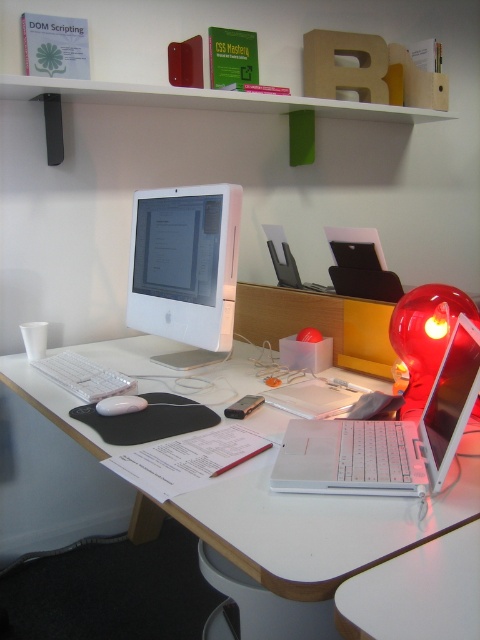
Can you confirm if white plastic laptop at right is shorter than white matte mouse at center?

In fact, white plastic laptop at right may be taller than white matte mouse at center.

Which is more to the right, white plastic laptop at right or white matte mouse at center?

white plastic laptop at right is more to the right.

Between point (417, 449) and point (130, 412), which one is positioned in front?

Point (417, 449) is more forward.

Where is `white plastic laptop at right`? The height and width of the screenshot is (640, 480). white plastic laptop at right is located at coordinates (386, 436).

Does white plastic keyboard at center appear on the left side of white matte mouse at center?

Yes, white plastic keyboard at center is to the left of white matte mouse at center.

Does point (52, 362) come in front of point (131, 401)?

No.

The width and height of the screenshot is (480, 640). I want to click on white plastic keyboard at center, so click(x=84, y=376).

Can you confirm if white plastic laptop at right is positioned to the right of white plastic keyboard at center?

Correct, you'll find white plastic laptop at right to the right of white plastic keyboard at center.

Does white plastic laptop at right have a greater width compared to white plastic keyboard at center?

Incorrect, white plastic laptop at right's width does not surpass white plastic keyboard at center's.

You are a GUI agent. You are given a task and a screenshot of the screen. Output one action in this format:
    pyautogui.click(x=<x>, y=<y>)
    Task: Click on the white plastic laptop at right
    
    Given the screenshot: What is the action you would take?
    pyautogui.click(x=386, y=436)